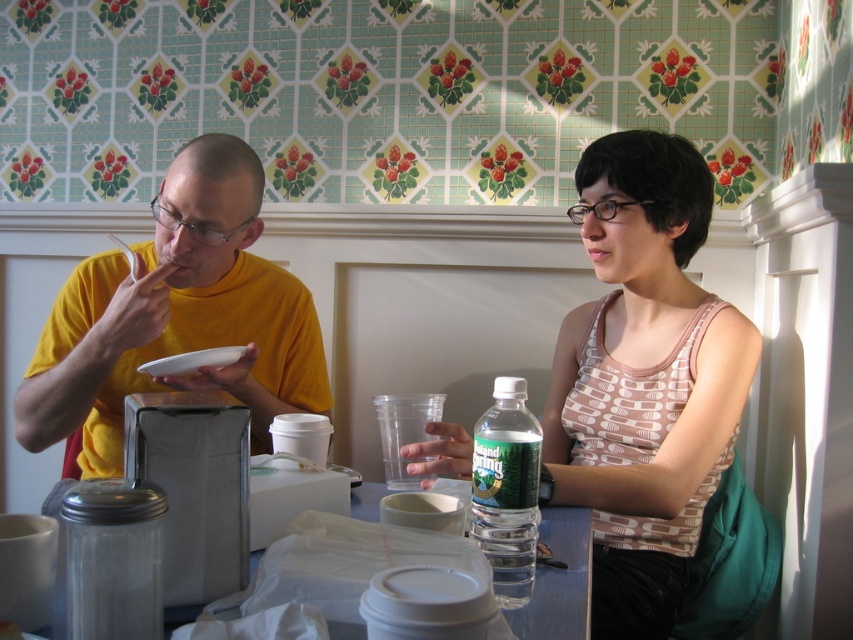
You are a server in a diner and need to place a new order on the table. The order includes a salad and a drink. The salad should be placed on the white matte plate at upper left, and the drink should be placed on the clear plastic table at lower center. However, the table has limited space. Can you fit both items without moving the existing items on the table?

The clear plastic table at lower center is positioned on the right side of the white matte plate at upper left, so there is enough space to place the salad on the white matte plate at upper left and the drink on the clear plastic table at lower center without moving existing items.

You are a customer sitting at the clear plastic table at lower center in a diner. You want to place your phone on the table. Is the table at a position that allows you to easily reach it from your seat?

The clear plastic table at lower center is positioned at point (x=558, y=580), which is a standard dining table placement, so yes, the table is at a position that allows you to easily reach it from your seat.

You are a photographer trying to capture a closeup of the yellow matte shirt at left without the white matte plate at upper left blocking the view. Can you adjust your position to achieve this?

The yellow matte shirt at left is in front of the white matte plate at upper left, so moving your camera position behind the shirt would allow you to capture the shirt without the plate blocking the view.